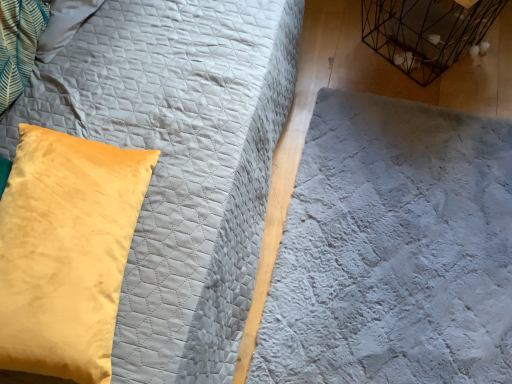
Question: From a real-world perspective, is velvet yellow pillow at left positioned over black wire birdcage at upper right based on gravity?

Choices:
 (A) no
 (B) yes

Answer: (B)

Question: Can you confirm if velvet yellow pillow at left is thinner than black wire birdcage at upper right?

Choices:
 (A) yes
 (B) no

Answer: (B)

Question: From a real-world perspective, is velvet yellow pillow at left physically below black wire birdcage at upper right?

Choices:
 (A) yes
 (B) no

Answer: (B)

Question: Can you confirm if velvet yellow pillow at left is wider than black wire birdcage at upper right?

Choices:
 (A) yes
 (B) no

Answer: (A)

Question: Is velvet yellow pillow at left closer to camera compared to black wire birdcage at upper right?

Choices:
 (A) no
 (B) yes

Answer: (B)

Question: In terms of height, does velvet yellow pillow at left look taller or shorter compared to white quilted fabric at center?

Choices:
 (A) tall
 (B) short

Answer: (A)

Question: From a real-world perspective, is velvet yellow pillow at left above or below white quilted fabric at center?

Choices:
 (A) below
 (B) above

Answer: (B)

Question: Considering the positions of velvet yellow pillow at left and white quilted fabric at center in the image, is velvet yellow pillow at left bigger or smaller than white quilted fabric at center?

Choices:
 (A) big
 (B) small

Answer: (B)

Question: Is velvet yellow pillow at left spatially inside white quilted fabric at center, or outside of it?

Choices:
 (A) outside
 (B) inside

Answer: (A)

Question: Considering the positions of white quilted fabric at center and velvet yellow pillow at left in the image, is white quilted fabric at center taller or shorter than velvet yellow pillow at left?

Choices:
 (A) short
 (B) tall

Answer: (A)

Question: Visually, is white quilted fabric at center positioned to the left or to the right of velvet yellow pillow at left?

Choices:
 (A) left
 (B) right

Answer: (B)

Question: Relative to velvet yellow pillow at left, is white quilted fabric at center in front or behind?

Choices:
 (A) behind
 (B) front

Answer: (A)

Question: From a real-world perspective, is white quilted fabric at center physically located above or below velvet yellow pillow at left?

Choices:
 (A) above
 (B) below

Answer: (B)

Question: In terms of size, does velvet yellow pillow at left appear bigger or smaller than black wire birdcage at upper right?

Choices:
 (A) big
 (B) small

Answer: (A)

Question: From the image's perspective, is velvet yellow pillow at left located above or below black wire birdcage at upper right?

Choices:
 (A) below
 (B) above

Answer: (A)